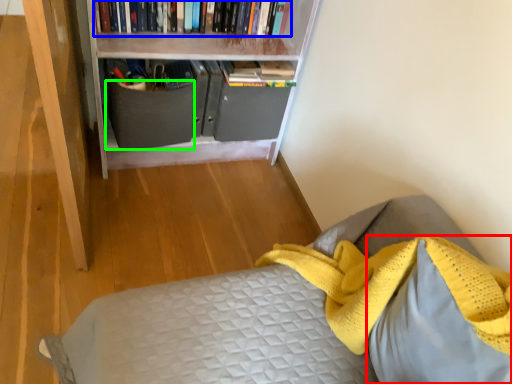
Question: Considering the real-world distances, which object is closest to pillow (highlighted by a red box)? book (highlighted by a blue box) or drawer (highlighted by a green box).

Choices:
 (A) book
 (B) drawer

Answer: (B)